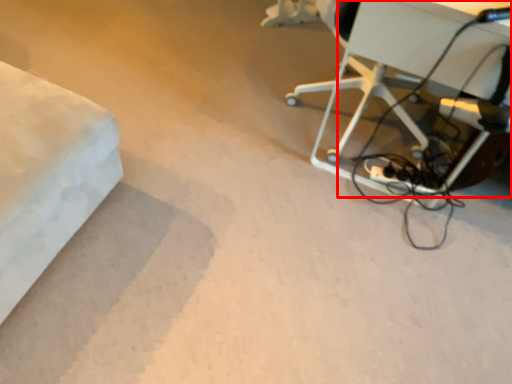
Question: From the image's perspective, where is table (annotated by the red box) located relative to extension cord?

Choices:
 (A) below
 (B) above

Answer: (B)